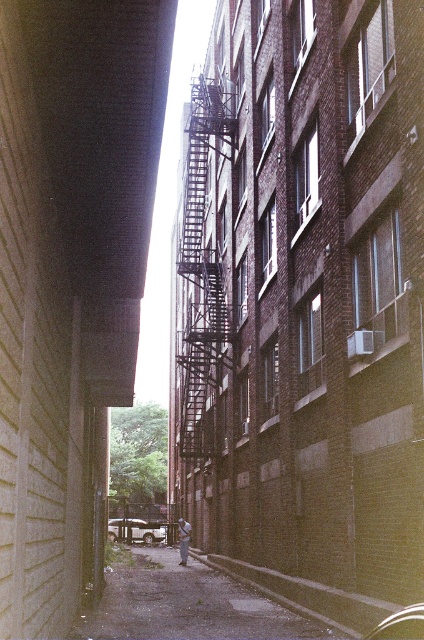
You are a delivery person trying to navigate through the narrow alleyway. You see the concrete sidewalk at center and the metallic fire escape at center. Which object is closer to the left side of the alley?

The concrete sidewalk at center is positioned on the left side of metallic fire escape at center, so it is closer to the left side of the alley.

You are a delivery person with a cart that requires 2 meters of space to maneuver. You are in the alleyway and see the concrete sidewalk at center and the metallic fire escape at center. Is there enough space to move your cart between them?

The concrete sidewalk at center is larger in size than the metallic fire escape at center, but the exact dimensions are not provided. However, since the sidewalk is larger, it might provide sufficient space for the cart. However, without specific measurements, it is uncertain if the 2 meters requirement is met.